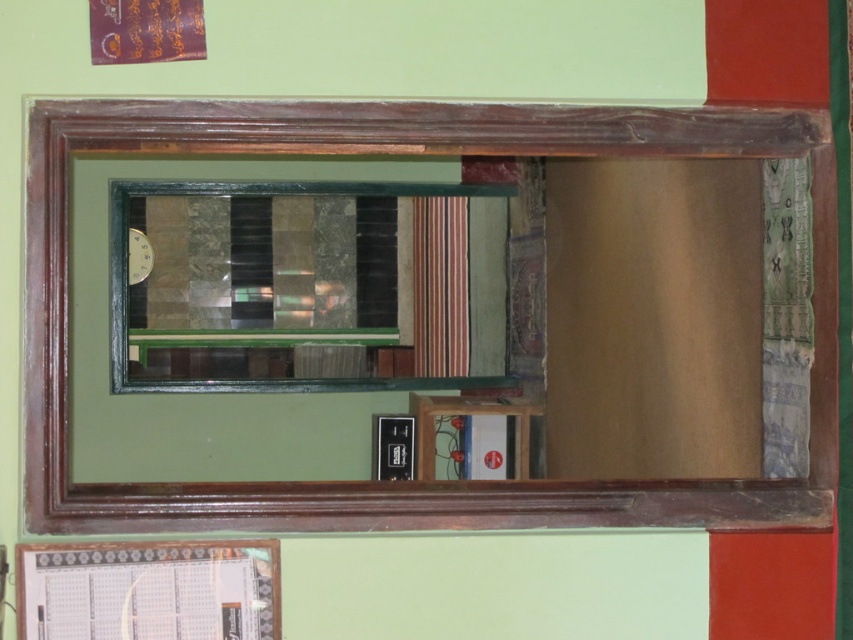
You are standing in a room and want to see your reflection. The wooden mirror at center and the green glass window at center are both in your view. Which object would show your reflection?

The wooden mirror at center is in front of the green glass window at center, so your reflection would be visible in the wooden mirror at center.

You are an interior designer planning to replace the wooden mirror at center and the green glass window at center with new items. Based on their current sizes, which object should you consider replacing first to maximize space efficiency?

The wooden mirror at center occupies less space than the green glass window at center, so you should replace the wooden mirror at center first to free up more space.

You are standing in front of the wooden mirror at center. If you want to take a selfie with your phone, which is 0.5 feet wide, can you fit the mirror and yourself in the frame without moving closer or farther away?

The distance between you and the wooden mirror at center is 8.83 feet. Since the mirror is at this distance, your phone camera can likely capture both you and the mirror in the frame without needing to adjust your position, as modern phone cameras have wide enough angles to include objects at that distance. However, exact framing depends on the specific camera lens and zoom settings.